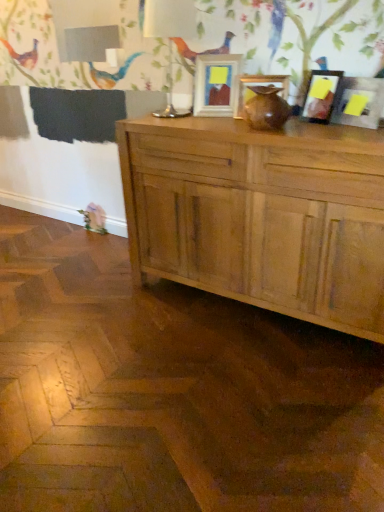
Where is `vacant space underneath white glossy table lamp at upper center (from a real-world perspective)`? This screenshot has height=512, width=384. vacant space underneath white glossy table lamp at upper center (from a real-world perspective) is located at coordinates (174, 115).